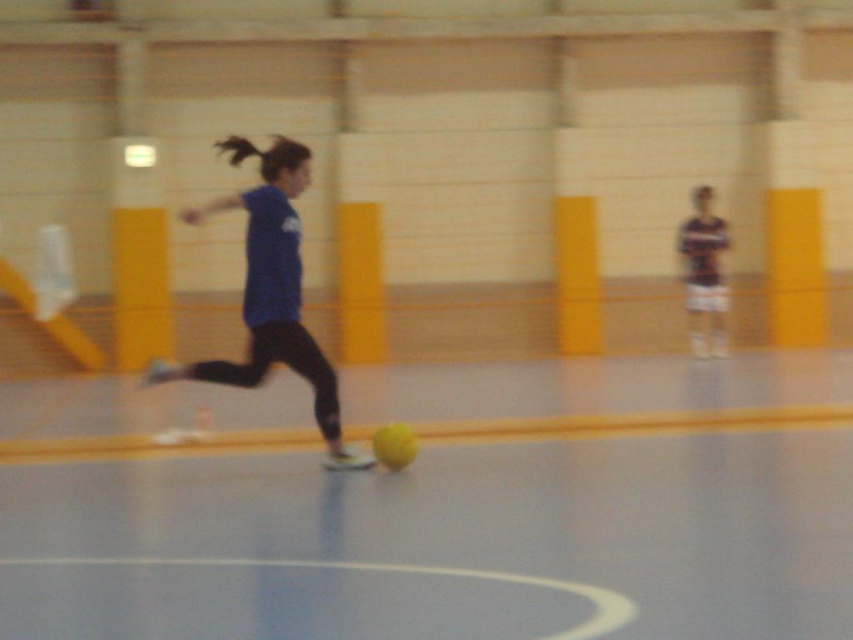
Question: Can you confirm if yellow rubber ball at center is positioned to the left of blue matte shirt at center?

Choices:
 (A) no
 (B) yes

Answer: (A)

Question: Among these objects, which one is nearest to the camera?

Choices:
 (A) blue matte shirt at center
 (B) yellow rubber ball at center

Answer: (B)

Question: Which of the following is the closest to the observer?

Choices:
 (A) (548, 371)
 (B) (260, 330)

Answer: (B)

Question: Can you confirm if yellow rubber ball at center is positioned above blue matte shirt at center?

Choices:
 (A) no
 (B) yes

Answer: (A)

Question: Does yellow rubber ball at center have a larger size compared to blue matte shirt at center?

Choices:
 (A) no
 (B) yes

Answer: (B)